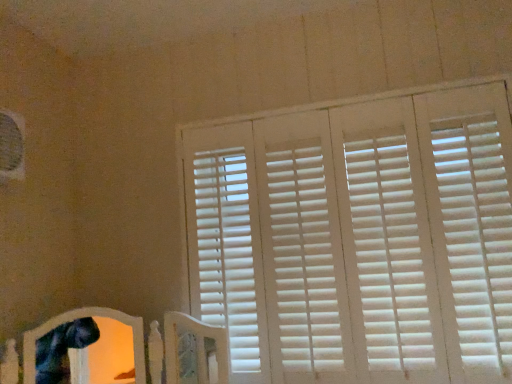
Question: Does white matte blinds at upper right appear on the right side of white wood bed frame at lower left?

Choices:
 (A) yes
 (B) no

Answer: (A)

Question: From the image's perspective, is white matte blinds at upper right below white wood bed frame at lower left?

Choices:
 (A) no
 (B) yes

Answer: (A)

Question: Is white matte blinds at upper right facing away from white wood bed frame at lower left?

Choices:
 (A) no
 (B) yes

Answer: (A)

Question: Is white matte blinds at upper right beside white wood bed frame at lower left?

Choices:
 (A) no
 (B) yes

Answer: (A)

Question: From a real-world perspective, is white matte blinds at upper right under white wood bed frame at lower left?

Choices:
 (A) yes
 (B) no

Answer: (B)

Question: Could you tell me if white matte blinds at upper right is facing white wood bed frame at lower left?

Choices:
 (A) yes
 (B) no

Answer: (A)

Question: Is white wood bed frame at lower left closer to camera compared to white matte blinds at upper right?

Choices:
 (A) yes
 (B) no

Answer: (A)

Question: Considering the relative sizes of white wood bed frame at lower left and white matte blinds at upper right in the image provided, is white wood bed frame at lower left wider than white matte blinds at upper right?

Choices:
 (A) yes
 (B) no

Answer: (A)

Question: Can you confirm if white wood bed frame at lower left is smaller than white matte blinds at upper right?

Choices:
 (A) yes
 (B) no

Answer: (A)

Question: Is there a large distance between white wood bed frame at lower left and white matte blinds at upper right?

Choices:
 (A) yes
 (B) no

Answer: (B)

Question: Does white wood bed frame at lower left have a larger size compared to white matte blinds at upper right?

Choices:
 (A) yes
 (B) no

Answer: (B)

Question: Is white wood bed frame at lower left oriented away from white matte blinds at upper right?

Choices:
 (A) no
 (B) yes

Answer: (A)

Question: Considering the positions of white matte blinds at upper right and white wood bed frame at lower left in the image, is white matte blinds at upper right bigger or smaller than white wood bed frame at lower left?

Choices:
 (A) big
 (B) small

Answer: (A)